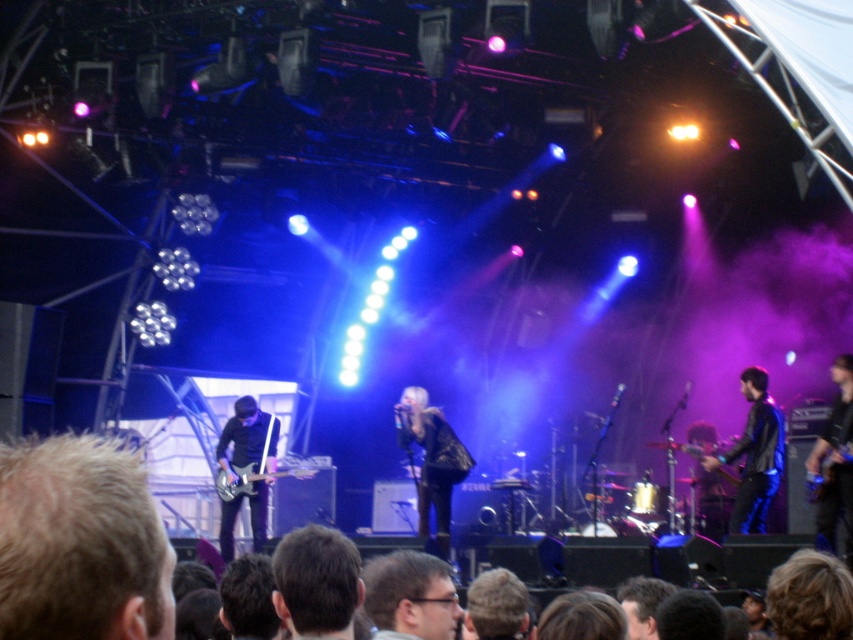
You are a photographer at the concert and want to capture a photo of both the black leather jacket at right and the metallic electric guitar at left. However, you need to ensure that neither object is blocking the other in the photo. Based on their positions, can you position yourself in a way that both are fully visible without obstruction?

The black leather jacket at right is in front of the metallic electric guitar at left, so to capture both without obstruction, you should position yourself to the side where the jacket and guitar are not overlapping. This might involve angling your camera to the left or right to ensure both are visible in the frame without one blocking the other.

You are a photographer at the concert. You want to capture a shot of the matte black glasses at lower center and the metallic electric guitar at left. Based on their positions, which object is located to the right of the other?

The matte black glasses at lower center are to the right of the metallic electric guitar at left.